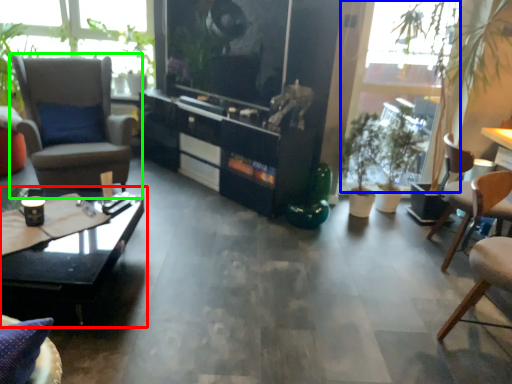
Question: Estimate the real-world distances between objects in this image. Which object is closer to coffee table (highlighted by a red box), window screen (highlighted by a blue box) or chair (highlighted by a green box)?

Choices:
 (A) window screen
 (B) chair

Answer: (B)